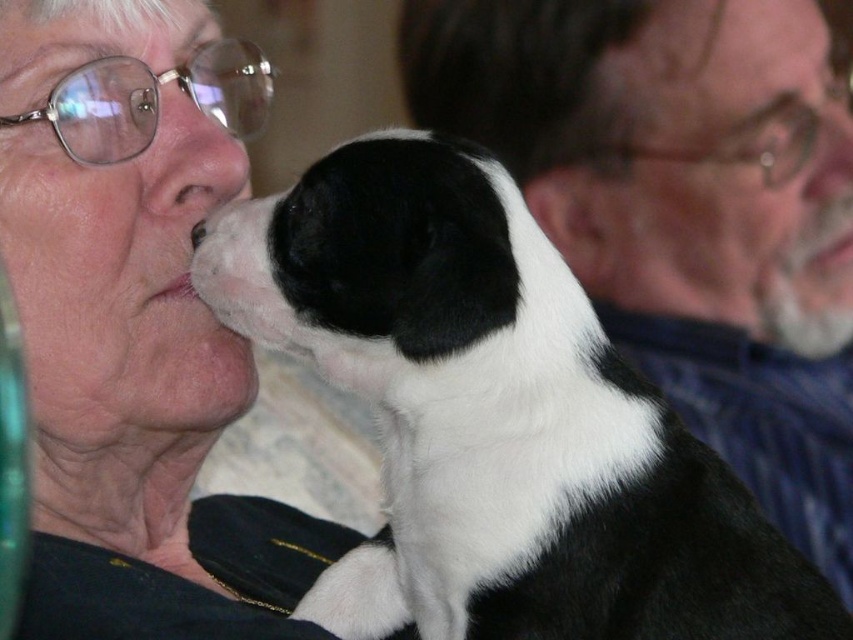
Between point (721, 522) and point (161, 426), which one is positioned behind?

Positioned behind is point (161, 426).

Consider the image. Who is positioned more to the right, black and white fur at center or matte black jacket at upper left?

From the viewer's perspective, black and white fur at center appears more on the right side.

You are a GUI agent. You are given a task and a screenshot of the screen. Output one action in this format:
    pyautogui.click(x=<x>, y=<y>)
    Task: Click on the black and white fur at center
    The image size is (853, 640).
    Given the screenshot: What is the action you would take?
    pyautogui.click(x=494, y=417)

Find the location of `black and white fur at center`. black and white fur at center is located at coordinates (494, 417).

Which of these two, matte black jacket at upper left or matte black nose at upper left, stands shorter?

matte black nose at upper left is shorter.

Can you confirm if matte black jacket at upper left is positioned below matte black nose at upper left?

Indeed, matte black jacket at upper left is positioned under matte black nose at upper left.

This screenshot has width=853, height=640. I want to click on matte black jacket at upper left, so click(134, 330).

Between black and white fur at center and matte black nose at upper left, which one appears on the right side from the viewer's perspective?

Positioned to the right is black and white fur at center.

Who is more forward, (602, 628) or (200, 113)?

Point (602, 628)

Where is `black and white fur at center`? This screenshot has height=640, width=853. black and white fur at center is located at coordinates (494, 417).